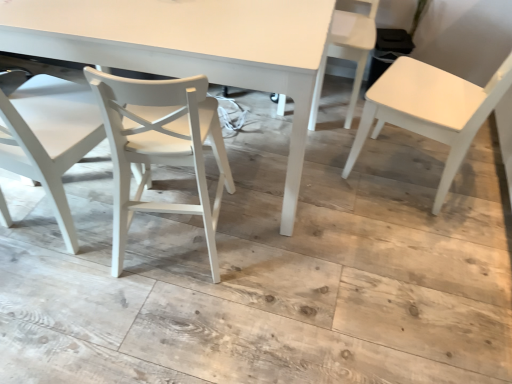
You are a GUI agent. You are given a task and a screenshot of the screen. Output one action in this format:
    pyautogui.click(x=<x>, y=<y>)
    Task: Click on the free region on the left part of white plastic chair at upper right, the third chair positioned from the left
    Image resolution: width=512 pixels, height=384 pixels.
    Given the screenshot: What is the action you would take?
    pyautogui.click(x=248, y=108)